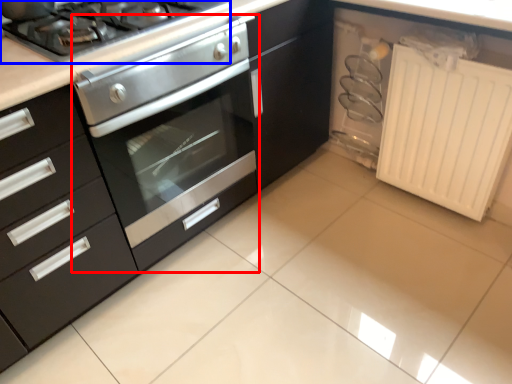
Question: Which point is further to the camera, oven (highlighted by a red box) or gas stove (highlighted by a blue box)?

Choices:
 (A) oven
 (B) gas stove

Answer: (B)